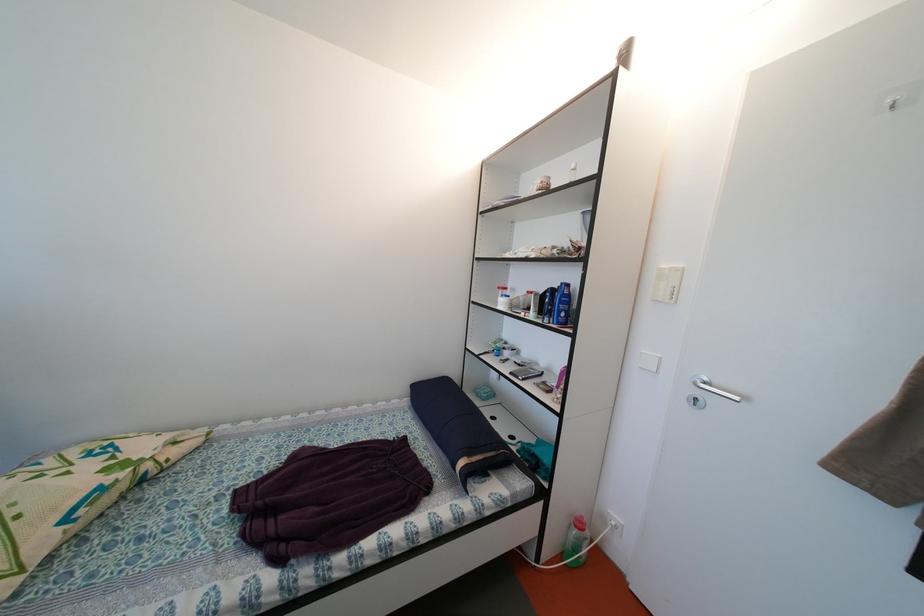
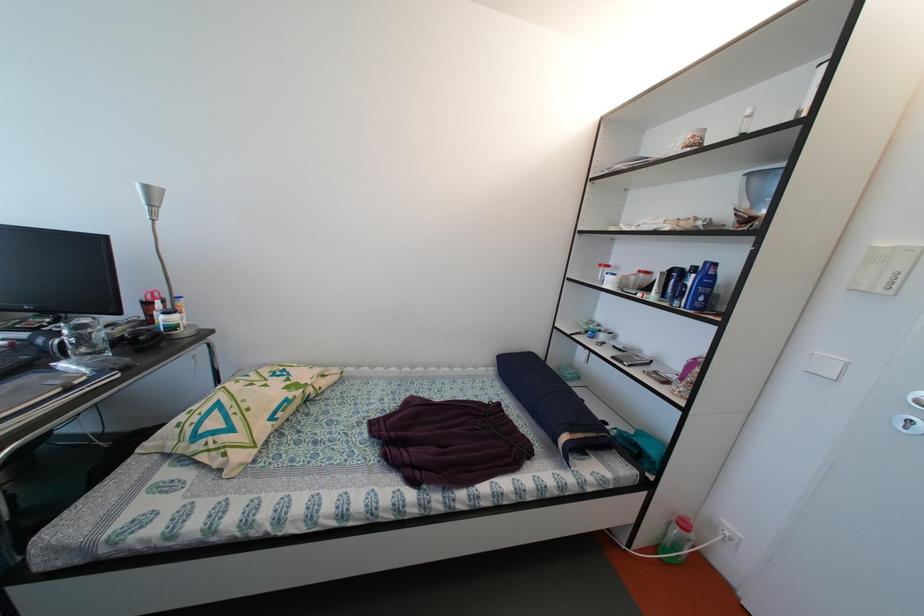
Question: Based on the continuous images, in which direction is the camera rotating? Reply with the corresponding letter.

Choices:
 (A) Left
 (B) Right
 (C) Up
 (D) Down

Answer: (A)